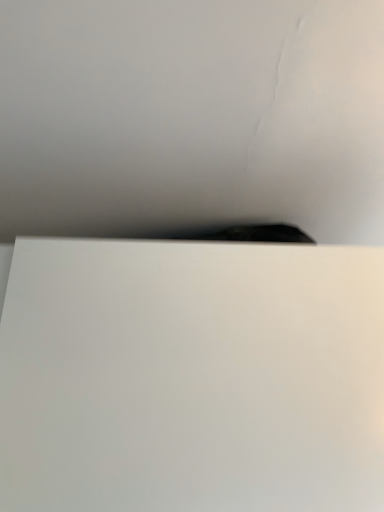
This screenshot has height=512, width=384. What do you see at coordinates (192, 116) in the screenshot?
I see `white matte wall at upper center` at bounding box center [192, 116].

This screenshot has height=512, width=384. I want to click on white matte wall at upper center, so click(x=192, y=116).

Identify the location of white matte wall at upper center. (192, 116).